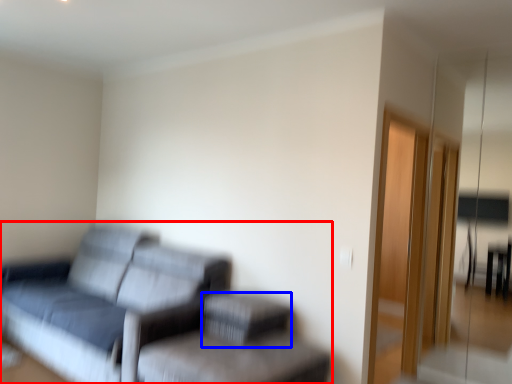
Question: Among these objects, which one is farthest to the camera, studio couch (highlighted by a red box) or footrest (highlighted by a blue box)?

Choices:
 (A) studio couch
 (B) footrest

Answer: (B)